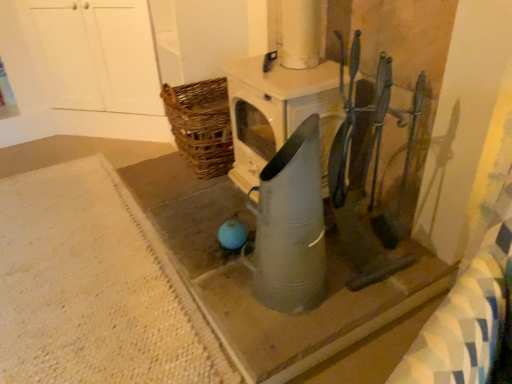
Question: Based on their positions, is white textured rug at lower left, arranged as the second concrete when viewed from the right, located to the left or right of metallic gray watering can at center?

Choices:
 (A) right
 (B) left

Answer: (B)

Question: From a real-world perspective, is white textured rug at lower left, arranged as the second concrete when viewed from the right, above or below metallic gray watering can at center?

Choices:
 (A) below
 (B) above

Answer: (A)

Question: Estimate the real-world distances between objects in this image. Which object is closer to the white textured rug at lower left, which is counted as the first concrete, starting from the left?

Choices:
 (A) metallic gray watering can at center, the 1th concrete viewed from the right
 (B) metallic gray watering can at center

Answer: (A)

Question: Estimate the real-world distances between objects in this image. Which object is farther from the white textured rug at lower left, arranged as the second concrete when viewed from the right?

Choices:
 (A) metallic gray watering can at center
 (B) metallic gray watering can at center, the 1th concrete viewed from the right

Answer: (A)